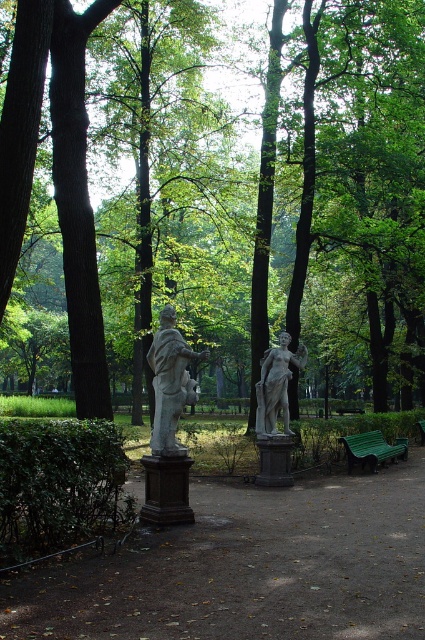
Is white marble statue at center below green painted wood bench at lower right?

Incorrect, white marble statue at center is not positioned below green painted wood bench at lower right.

Which is below, white marble statue at center or green painted wood bench at lower right?

green painted wood bench at lower right

Describe the element at coordinates (275, 385) in the screenshot. Image resolution: width=425 pixels, height=640 pixels. I see `white marble statue at center` at that location.

The height and width of the screenshot is (640, 425). I want to click on white marble statue at center, so click(x=275, y=385).

Is gray stone statue at center above green painted wood bench at lower right?

Indeed, gray stone statue at center is positioned over green painted wood bench at lower right.

Does gray stone statue at center have a lesser width compared to green painted wood bench at lower right?

Indeed, gray stone statue at center has a lesser width compared to green painted wood bench at lower right.

The image size is (425, 640). In order to click on gray stone statue at center in this screenshot , I will do `click(170, 384)`.

Find the location of a particular element. The height and width of the screenshot is (640, 425). gray stone statue at center is located at coordinates (170, 384).

Which is more to the right, brown wood tree at center or green painted wood bench at lower right?

green painted wood bench at lower right

Is the position of brown wood tree at center less distant than that of green painted wood bench at lower right?

Yes, it is.

Where is `brown wood tree at center`? The image size is (425, 640). brown wood tree at center is located at coordinates point(252,193).

Where is `brown wood tree at center`? brown wood tree at center is located at coordinates (252, 193).